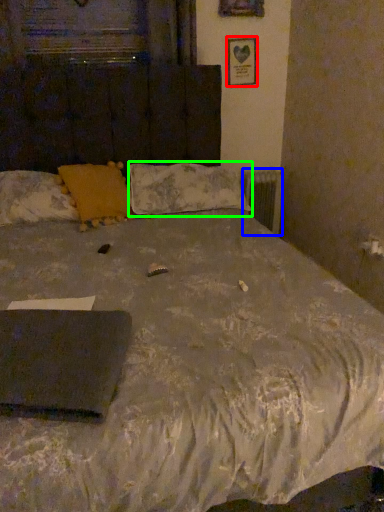
Question: Which is farther away from picture frame (highlighted by a red box)? radiator (highlighted by a blue box) or pillow (highlighted by a green box)?

Choices:
 (A) radiator
 (B) pillow

Answer: (B)